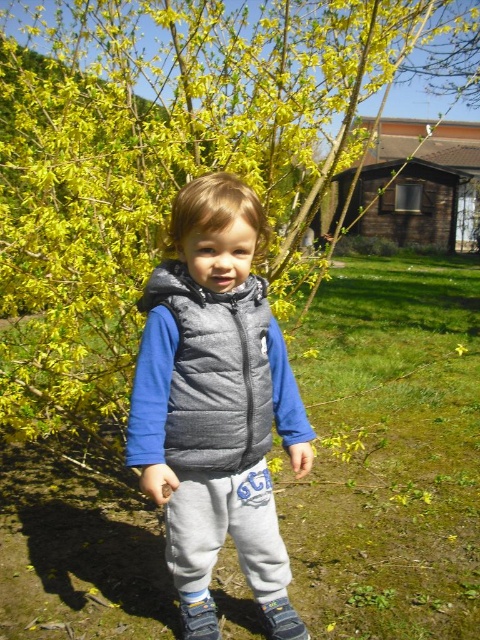
Is green grass at center to the right of gray puffer vest at center from the viewer's perspective?

Correct, you'll find green grass at center to the right of gray puffer vest at center.

Is point (112, 476) positioned after point (211, 436)?

Yes, point (112, 476) is behind point (211, 436).

Is point (389, 586) positioned after point (179, 285)?

Yes.

Find the location of a particular element. This screenshot has width=480, height=640. green grass at center is located at coordinates (388, 452).

What are the coordinates of `green grass at center` in the screenshot? It's located at coord(388,452).

In the scene shown: Is green grass at center to the left of dark gray puffer vest at center from the viewer's perspective?

Incorrect, green grass at center is not on the left side of dark gray puffer vest at center.

Who is more forward, [408,611] or [155,432]?

Point [155,432]

Where is `green grass at center`? green grass at center is located at coordinates (388, 452).

Who is taller, dark gray puffer vest at center or gray fleece pants at center?

Standing taller between the two is dark gray puffer vest at center.

Is dark gray puffer vest at center bigger than gray fleece pants at center?

Yes, dark gray puffer vest at center is bigger than gray fleece pants at center.

Does point (215, 468) lie in front of point (207, 554)?

Yes, it is.

Find the location of `dark gray puffer vest at center`. dark gray puffer vest at center is located at coordinates (210, 378).